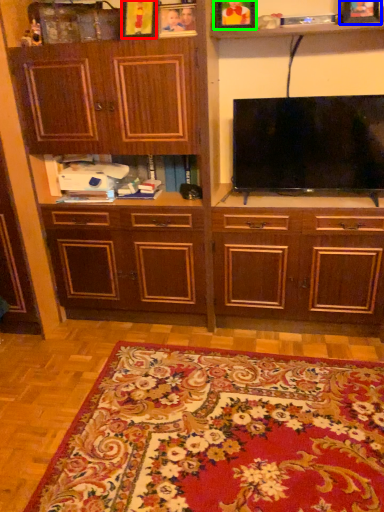
Question: Considering the real-world distances, which object is closest to picture frame (highlighted by a red box)? picture frame (highlighted by a blue box) or picture frame (highlighted by a green box).

Choices:
 (A) picture frame
 (B) picture frame

Answer: (B)